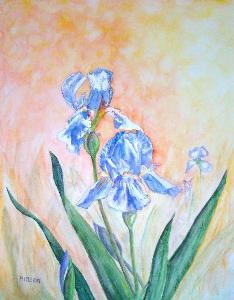
Where is `painting`? painting is located at coordinates (217, 261).